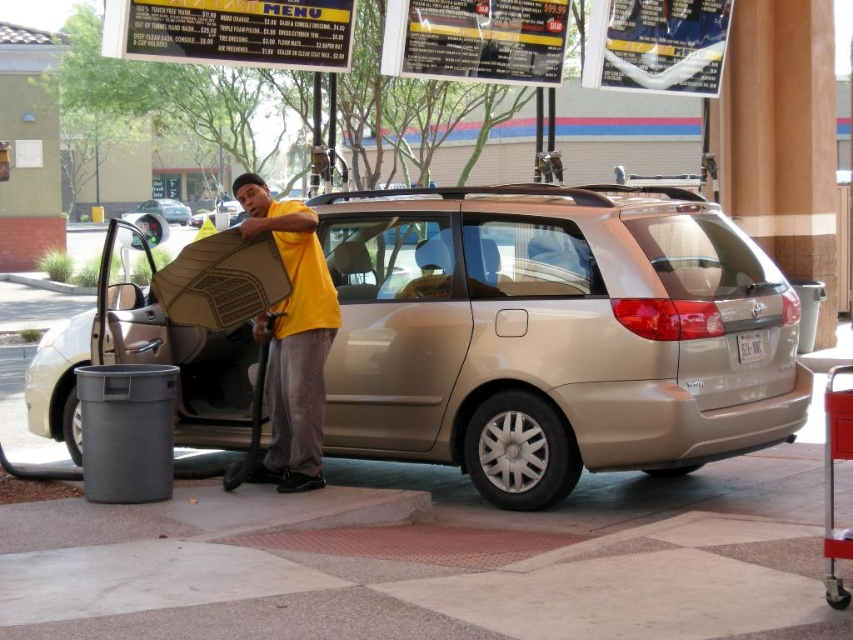
Question: Estimate the real-world distances between objects in this image. Which object is farther from the gold metallic van at center?

Choices:
 (A) yellow matte shirt at center
 (B) gold metallic suv at center

Answer: (A)

Question: Considering the real-world distances, which object is closest to the gold metallic van at center?

Choices:
 (A) yellow matte shirt at center
 (B) gold metallic suv at center

Answer: (B)

Question: Is yellow matte shirt at center behind gold metallic van at center?

Choices:
 (A) yes
 (B) no

Answer: (B)

Question: Which of the following is the closest to the observer?

Choices:
 (A) [242, 184]
 (B) [146, 204]

Answer: (A)

Question: Considering the relative positions of yellow matte shirt at center and gold metallic van at center in the image provided, where is yellow matte shirt at center located with respect to gold metallic van at center?

Choices:
 (A) above
 (B) below

Answer: (B)

Question: Can you confirm if yellow matte shirt at center is positioned to the left of gold metallic van at center?

Choices:
 (A) no
 (B) yes

Answer: (A)